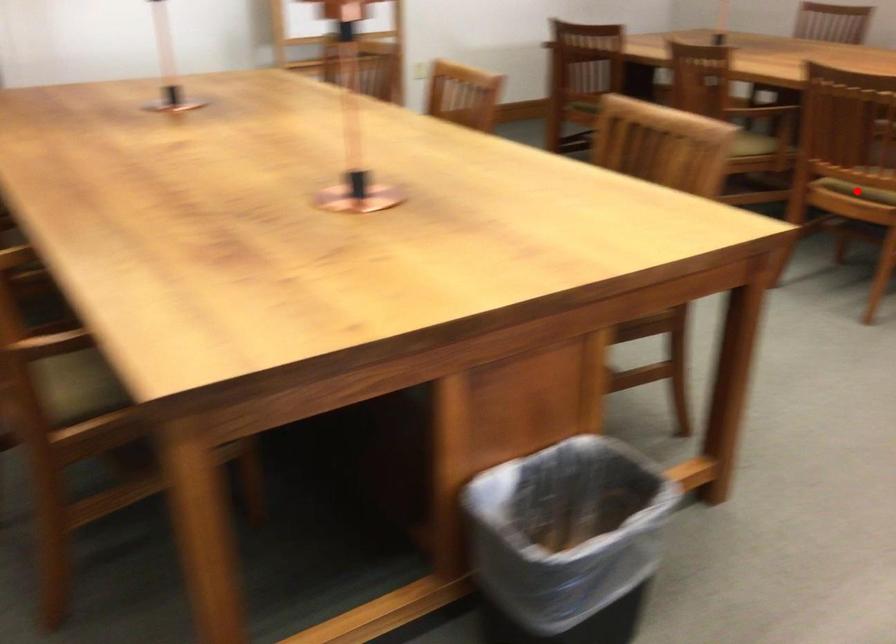
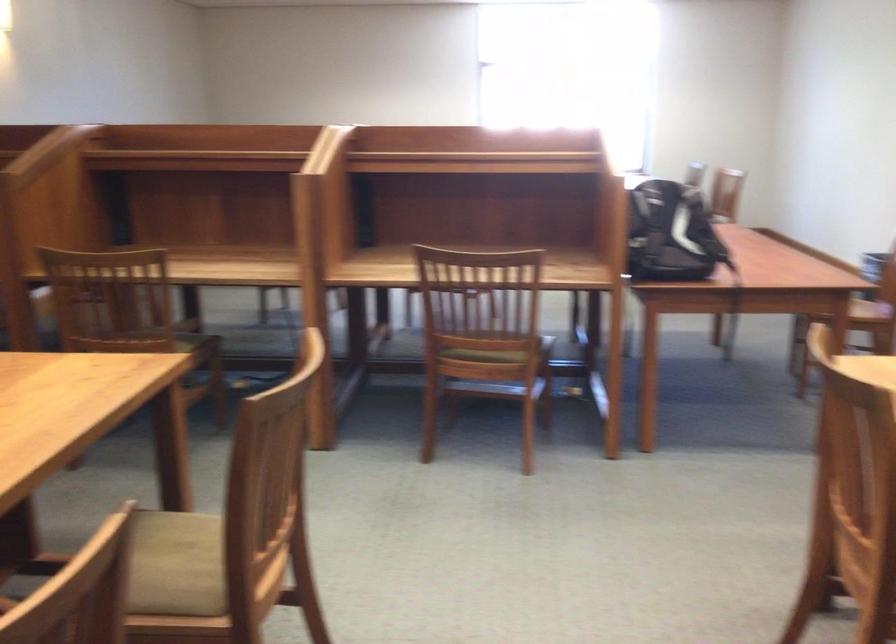
Question: I am providing you with two images of the same scene from different viewpoints. A red point is marked on the first image. Is the red point's position out of view in image 2?

Choices:
 (A) Yes
 (B) No

Answer: (A)